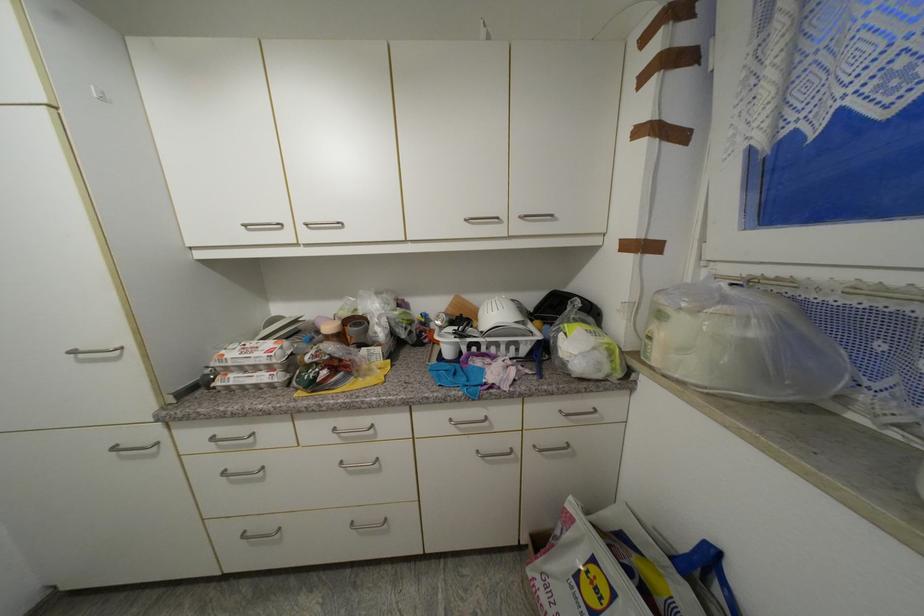
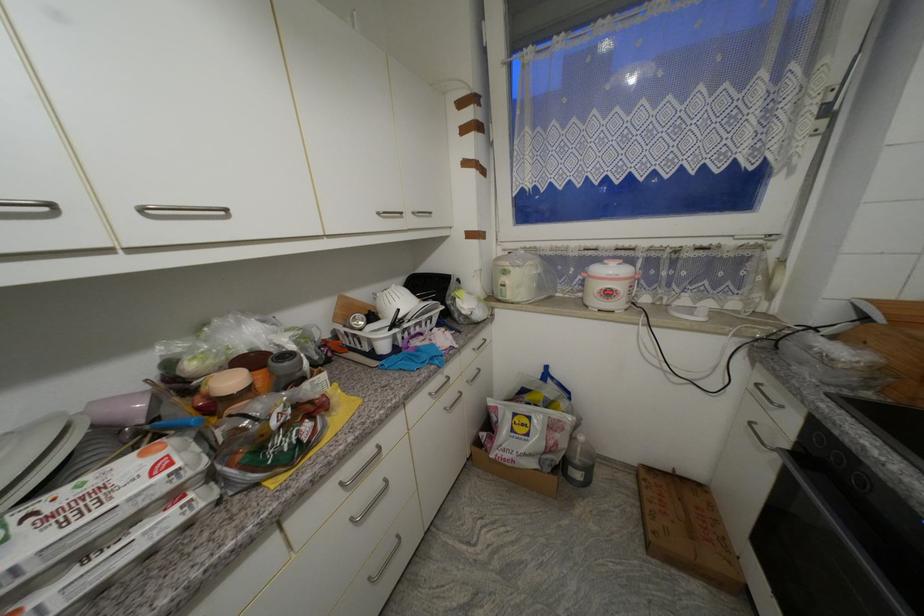
Locate, in the second image, the point that corresponds to the point at 341,430 in the first image.

(347, 485)